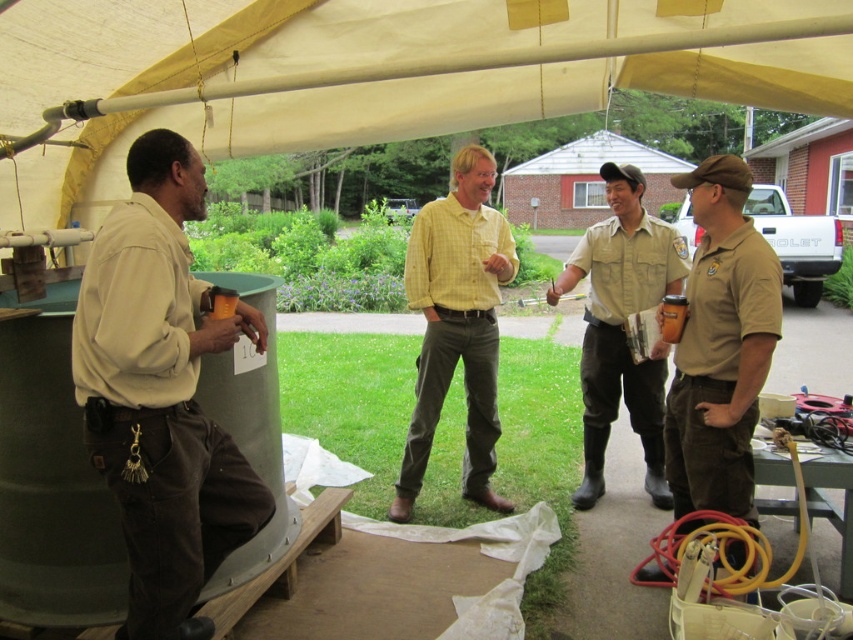
Question: Which point is closer to the camera?

Choices:
 (A) (773, 262)
 (B) (157, 435)

Answer: (B)

Question: Is matte khaki shirt at left further to the viewer compared to matte khaki uniform at right?

Choices:
 (A) yes
 (B) no

Answer: (B)

Question: Can you confirm if matte khaki uniform at right is positioned above khaki uniform at center?

Choices:
 (A) no
 (B) yes

Answer: (A)

Question: Is matte khaki uniform at right wider than khaki uniform at center?

Choices:
 (A) no
 (B) yes

Answer: (A)

Question: Which of these objects is positioned closest to the matte khaki shirt at left?

Choices:
 (A) khaki uniform at center
 (B) matte khaki uniform at right
 (C) yellow checkered shirt at center

Answer: (C)

Question: Among these points, which one is nearest to the camera?

Choices:
 (A) (693, 467)
 (B) (409, 252)

Answer: (A)